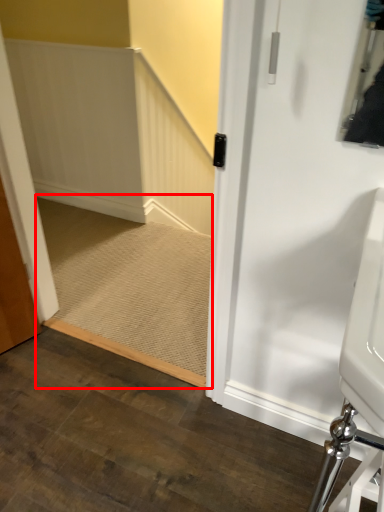
Question: Considering the relative positions of stairs (annotated by the red box) and sink in the image provided, where is stairs (annotated by the red box) located with respect to the staircase?

Choices:
 (A) left
 (B) right

Answer: (A)